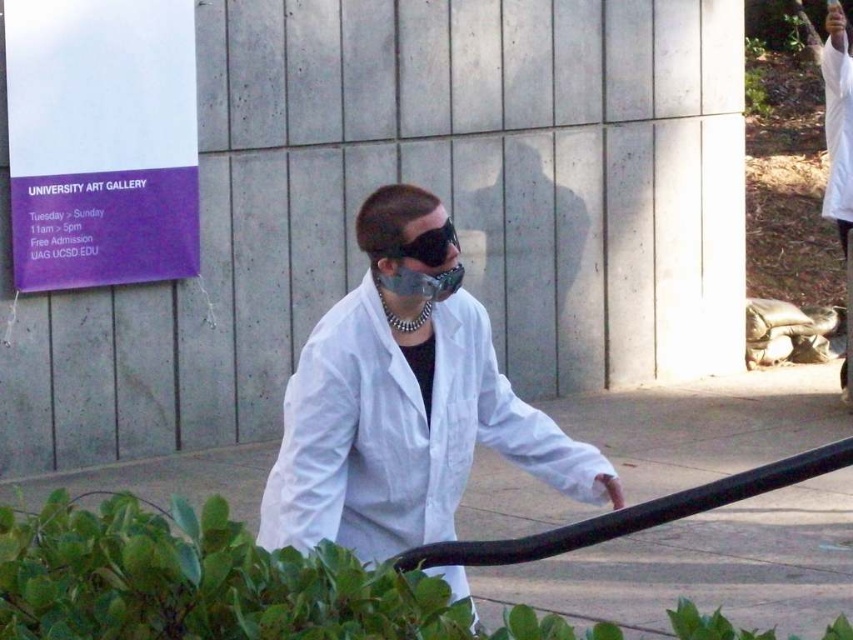
You are a security guard at the university art gallery. You need to ensure that the white matte lab coat at center and the black matte sunglasses at center are visible in the surveillance footage. Given their sizes, which object will appear larger in the camera feed?

The white matte lab coat at center is taller than the black matte sunglasses at center, so it will appear larger in the surveillance footage.

You are a fashion designer observing the person in the image. You need to determine if the distance between the white matte lab coat at center and the black matte sunglasses at center is sufficient to attach a decorative chain between them. The chain you have is 15 inches long. Can the chain fit between them?

The white matte lab coat at center and the black matte sunglasses at center are 15.68 inches apart from each other. Since the chain is 15 inches long, it is slightly shorter than the distance between them. Therefore, the chain cannot fit between the white matte lab coat at center and the black matte sunglasses at center.

Consider the image. What is the location of the point with coordinates (404, 404) in the image?

The point with coordinates (404, 404) is located on the white matte lab coat at center.